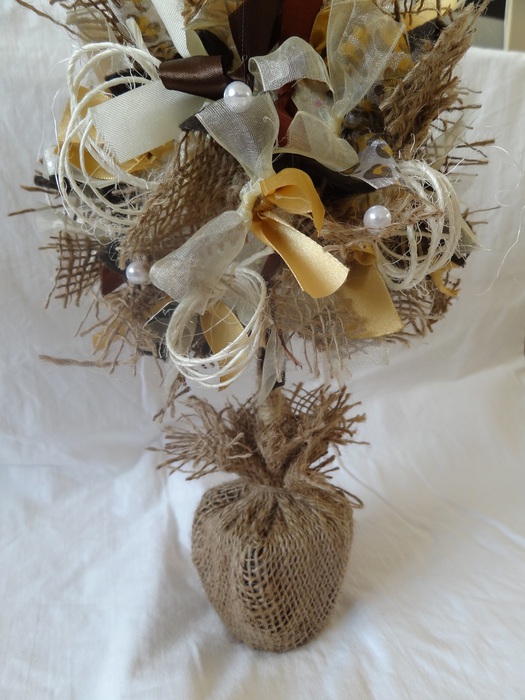
The image size is (525, 700). What are the coordinates of `table cloth` in the screenshot? It's located at (375, 559).